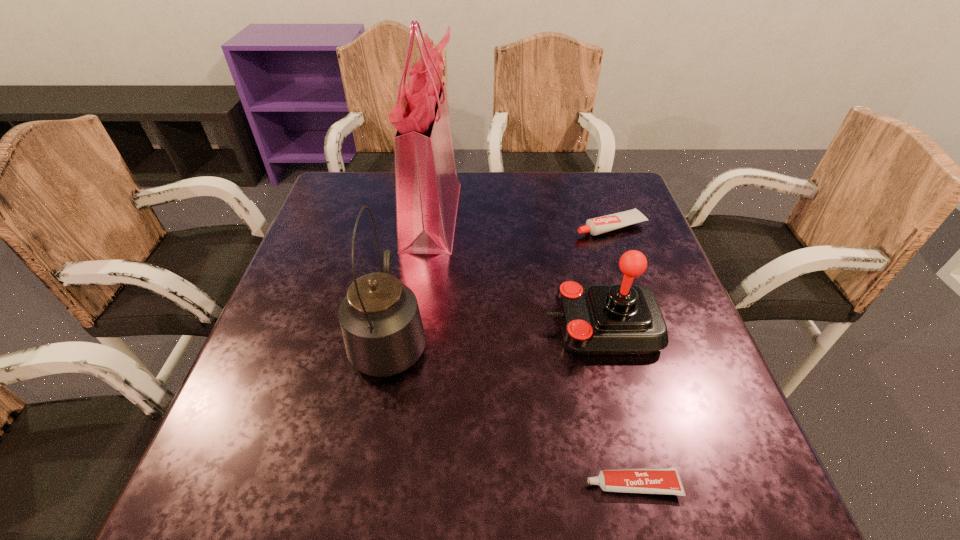
You are a GUI agent. You are given a task and a screenshot of the screen. Output one action in this format:
    pyautogui.click(x=<x>, y=<y>)
    Task: Click on the object that is at the near edge
    This screenshot has width=960, height=540.
    Given the screenshot: What is the action you would take?
    pyautogui.click(x=665, y=480)

Identify the location of joystick present at the right edge. (623, 319).

The width and height of the screenshot is (960, 540). Find the location of `object located in the far right corner section of the desktop`. object located in the far right corner section of the desktop is located at coordinates click(595, 226).

The width and height of the screenshot is (960, 540). What are the coordinates of `object located at the near right corner` in the screenshot? It's located at (665, 480).

Identify the location of vacant space at the far edge of the desktop. Image resolution: width=960 pixels, height=540 pixels. (570, 209).

Find the location of a particular element. The height and width of the screenshot is (540, 960). vacant space at the near edge of the desktop is located at coordinates (521, 495).

The height and width of the screenshot is (540, 960). Find the location of `vacant position at the left edge of the desktop`. vacant position at the left edge of the desktop is located at coordinates (335, 225).

I want to click on blank space at the right edge of the desktop, so click(x=721, y=406).

I want to click on free space at the far left corner of the desktop, so click(348, 213).

The width and height of the screenshot is (960, 540). I want to click on blank space at the far right corner, so click(603, 175).